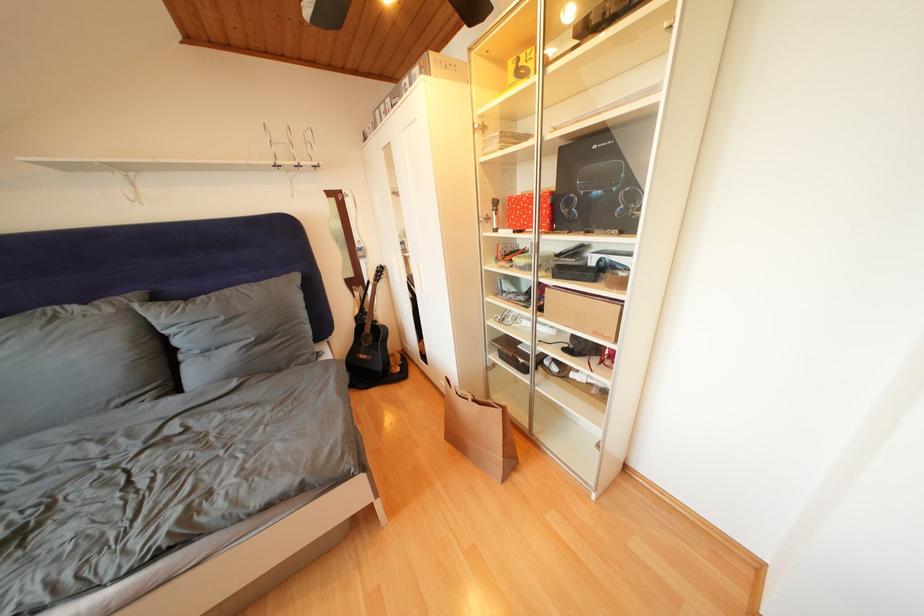
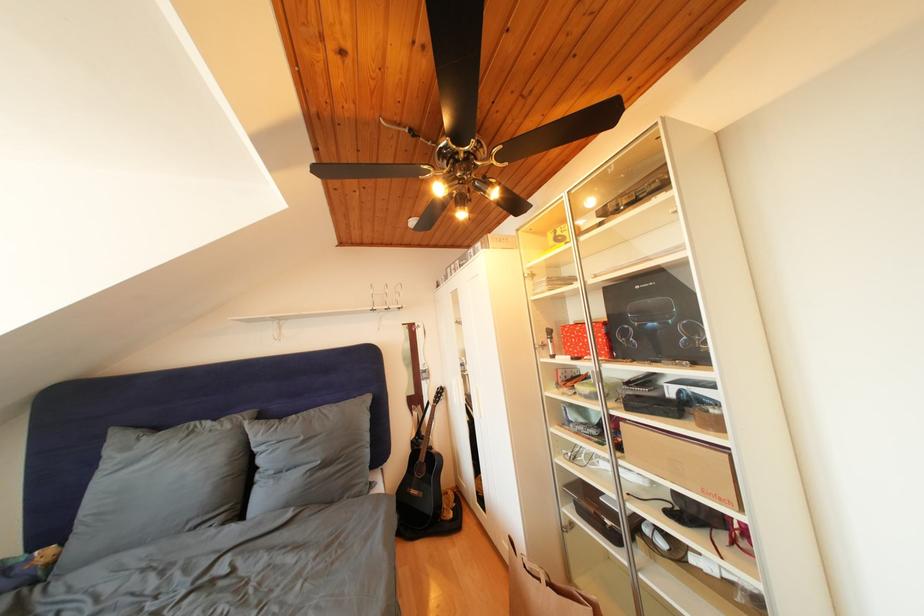
In the second image, find the point that corresponds to [495,224] in the first image.

(552, 351)